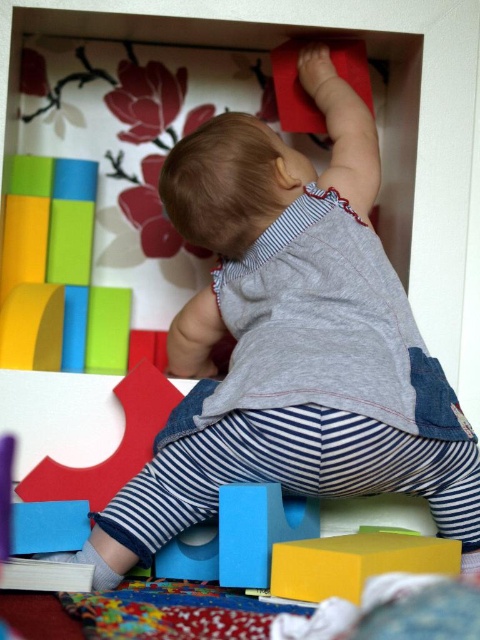
You are a parent observing your child playing with the yellow matte block at lower center and the matte blue block at lower center. Which block should you hand to the child if you want to give them the bigger one?

You should hand the yellow matte block at lower center to the child since it has a larger size compared to the matte blue block at lower center.

You are a photographer trying to capture the perfect shot of the child and the red block. The camera you are using has a focal length of 50mm and an aperture of f2.8. You want to ensure that the point at coordinates point (311,566) is in focus. Given the camera settings, what is the minimum distance you need to be from the point to achieve sharp focus?

The point at coordinates point (311,566) is 30.93 inches from the camera. To achieve sharp focus with a 50mm lens at f2.8, the minimum distance should be at least 30.93 inches.

Consider the image. You are a parent observing your child playing with the yellow matte block at lower center and the matte blue block at lower center. Which block should you hand to the child if you want to give them the taller one?

The matte blue block at lower center is taller than the yellow matte block at lower center, so you should hand the matte blue block at lower center to the child.